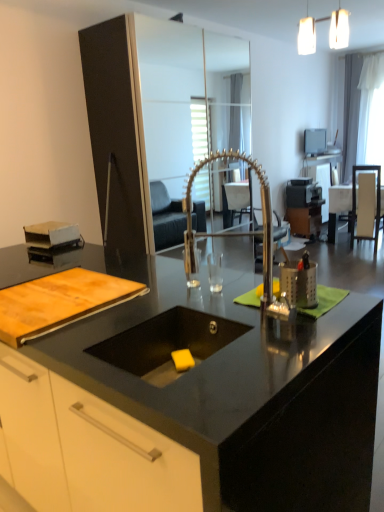
Question: Can you confirm if white fabric armchair at right is wider than black glossy sink at center?

Choices:
 (A) yes
 (B) no

Answer: (A)

Question: From a real-world perspective, is white fabric armchair at right on black glossy sink at center?

Choices:
 (A) yes
 (B) no

Answer: (B)

Question: Would you say white fabric armchair at right contains black glossy sink at center?

Choices:
 (A) no
 (B) yes

Answer: (A)

Question: Can you confirm if white fabric armchair at right is smaller than black glossy sink at center?

Choices:
 (A) no
 (B) yes

Answer: (A)

Question: From the image's perspective, is white fabric armchair at right located beneath black glossy sink at center?

Choices:
 (A) yes
 (B) no

Answer: (B)

Question: Can you confirm if white fabric armchair at right is taller than black glossy sink at center?

Choices:
 (A) no
 (B) yes

Answer: (B)

Question: Considering the relative positions of wooden cutting board at lower left and white fabric armchair at right in the image provided, is wooden cutting board at lower left to the right of white fabric armchair at right from the viewer's perspective?

Choices:
 (A) no
 (B) yes

Answer: (A)

Question: From a real-world perspective, is wooden cutting board at lower left located beneath white fabric armchair at right?

Choices:
 (A) no
 (B) yes

Answer: (A)

Question: Does wooden cutting board at lower left have a lesser width compared to white fabric armchair at right?

Choices:
 (A) yes
 (B) no

Answer: (B)

Question: Considering the relative sizes of wooden cutting board at lower left and white fabric armchair at right in the image provided, is wooden cutting board at lower left bigger than white fabric armchair at right?

Choices:
 (A) no
 (B) yes

Answer: (A)

Question: Does wooden cutting board at lower left have a greater height compared to white fabric armchair at right?

Choices:
 (A) yes
 (B) no

Answer: (B)

Question: Is wooden cutting board at lower left closer to camera compared to white fabric armchair at right?

Choices:
 (A) no
 (B) yes

Answer: (B)

Question: Is wooden table at right smaller than polished metallic faucet at center?

Choices:
 (A) yes
 (B) no

Answer: (B)